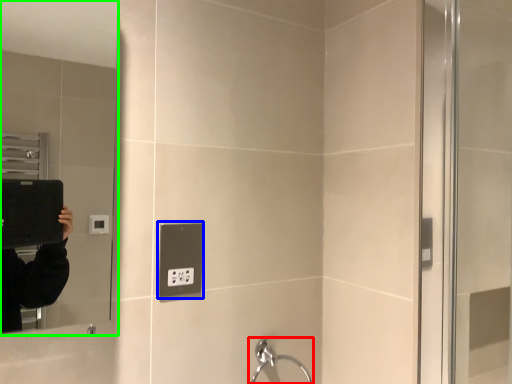
Question: Which is farther away from faucet (highlighted by a red box)? electric outlet (highlighted by a blue box) or mirror (highlighted by a green box)?

Choices:
 (A) electric outlet
 (B) mirror

Answer: (B)